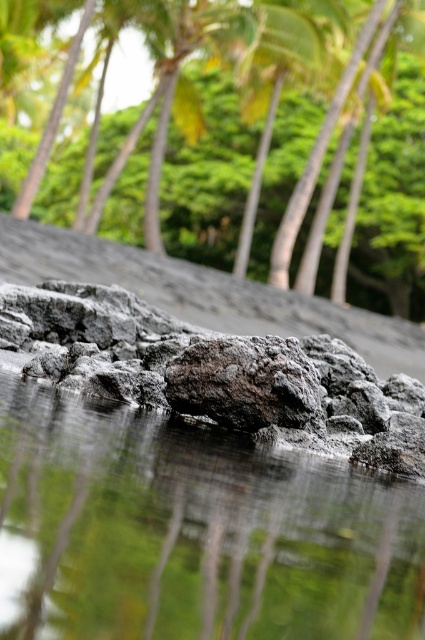
Question: Which object is closer to the camera taking this photo?

Choices:
 (A) reflective wet rock at center
 (B) green leafy palm tree at upper center

Answer: (A)

Question: Is reflective wet rock at center wider than rough gray rock at center?

Choices:
 (A) yes
 (B) no

Answer: (A)

Question: Which point appears closest to the camera in this image?

Choices:
 (A) (311, 422)
 (B) (36, 593)

Answer: (B)

Question: Which point is farther to the camera?

Choices:
 (A) rough gray rock at center
 (B) green leafy palm tree at upper center
 (C) reflective wet rock at center

Answer: (B)

Question: Does reflective wet rock at center have a greater width compared to rough gray rock at center?

Choices:
 (A) yes
 (B) no

Answer: (A)

Question: Can you confirm if reflective wet rock at center is smaller than rough gray rock at center?

Choices:
 (A) no
 (B) yes

Answer: (A)